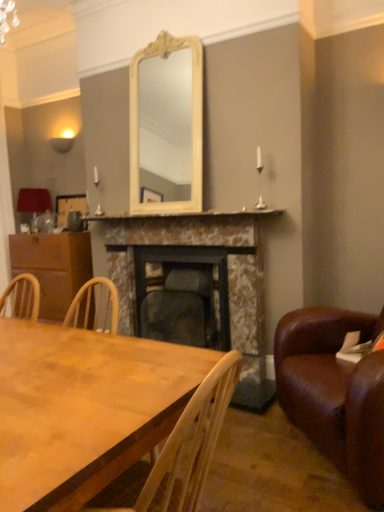
You are a GUI agent. You are given a task and a screenshot of the screen. Output one action in this format:
    pyautogui.click(x=<x>, y=<y>)
    Task: Click on the empty space that is ontop of wooden picture frame at left
    This screenshot has width=384, height=512.
    Given the screenshot: What is the action you would take?
    pyautogui.click(x=74, y=193)